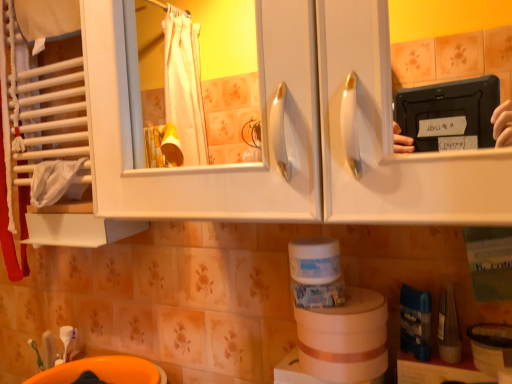
Question: Which direction should I rotate to look at beige cardboard roll at lower center, the 2th toilet paper viewed from the top?

Choices:
 (A) right
 (B) left

Answer: (A)

Question: Which direction should I rotate to look at white matte container at center, the 1th toilet paper viewed from the top?

Choices:
 (A) right
 (B) left

Answer: (A)

Question: Can you confirm if orange plastic sink at lower left is taller than white matte container at center, marked as the second toilet paper in a bottom-to-top arrangement?

Choices:
 (A) yes
 (B) no

Answer: (A)

Question: Is orange plastic sink at lower left located outside white matte container at center, marked as the second toilet paper in a bottom-to-top arrangement?

Choices:
 (A) yes
 (B) no

Answer: (A)

Question: From the image's perspective, is orange plastic sink at lower left below white matte container at center, marked as the second toilet paper in a bottom-to-top arrangement?

Choices:
 (A) yes
 (B) no

Answer: (A)

Question: Can you confirm if orange plastic sink at lower left is smaller than white matte container at center, the 1th toilet paper viewed from the top?

Choices:
 (A) no
 (B) yes

Answer: (A)

Question: Is orange plastic sink at lower left at the right side of white matte container at center, marked as the second toilet paper in a bottom-to-top arrangement?

Choices:
 (A) yes
 (B) no

Answer: (B)

Question: Can you confirm if orange plastic sink at lower left is positioned to the left of white matte container at center, marked as the second toilet paper in a bottom-to-top arrangement?

Choices:
 (A) no
 (B) yes

Answer: (B)

Question: Does white matte container at center, marked as the second toilet paper in a bottom-to-top arrangement, lie in front of beige cardboard roll at lower center, which is the 1th toilet paper in bottom-to-top order?

Choices:
 (A) yes
 (B) no

Answer: (B)

Question: Considering the relative sizes of white matte container at center, marked as the second toilet paper in a bottom-to-top arrangement, and beige cardboard roll at lower center, which is the 1th toilet paper in bottom-to-top order, in the image provided, is white matte container at center, marked as the second toilet paper in a bottom-to-top arrangement, shorter than beige cardboard roll at lower center, which is the 1th toilet paper in bottom-to-top order,?

Choices:
 (A) yes
 (B) no

Answer: (A)

Question: Can you confirm if white matte container at center, the 1th toilet paper viewed from the top, is taller than beige cardboard roll at lower center, which is the 1th toilet paper in bottom-to-top order?

Choices:
 (A) yes
 (B) no

Answer: (B)

Question: Does white matte container at center, the 1th toilet paper viewed from the top, have a larger size compared to beige cardboard roll at lower center, which is the 1th toilet paper in bottom-to-top order?

Choices:
 (A) no
 (B) yes

Answer: (A)

Question: From a real-world perspective, is white matte container at center, marked as the second toilet paper in a bottom-to-top arrangement, positioned over beige cardboard roll at lower center, which is the 1th toilet paper in bottom-to-top order, based on gravity?

Choices:
 (A) no
 (B) yes

Answer: (B)

Question: Can you confirm if white matte container at center, marked as the second toilet paper in a bottom-to-top arrangement, is wider than beige cardboard roll at lower center, which is the 1th toilet paper in bottom-to-top order?

Choices:
 (A) yes
 (B) no

Answer: (B)

Question: Is beige cardboard roll at lower center, the 2th toilet paper viewed from the top, wider than orange plastic sink at lower left?

Choices:
 (A) no
 (B) yes

Answer: (A)